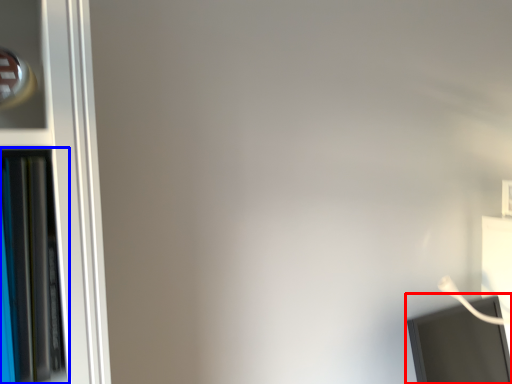
Question: Among these objects, which one is farthest to the camera, computer monitor (highlighted by a red box) or bookcase (highlighted by a blue box)?

Choices:
 (A) computer monitor
 (B) bookcase

Answer: (A)